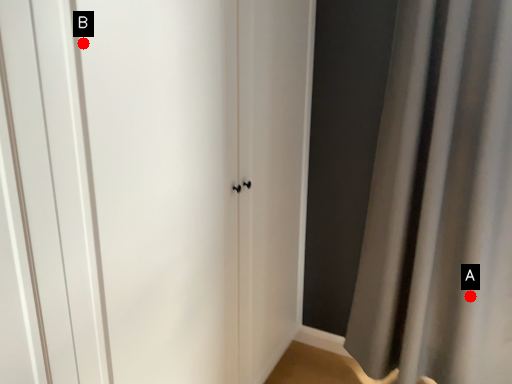
Question: Two points are circled on the image, labeled by A and B beside each circle. Which point is farther from the camera taking this photo?

Choices:
 (A) A is further
 (B) B is further

Answer: (A)